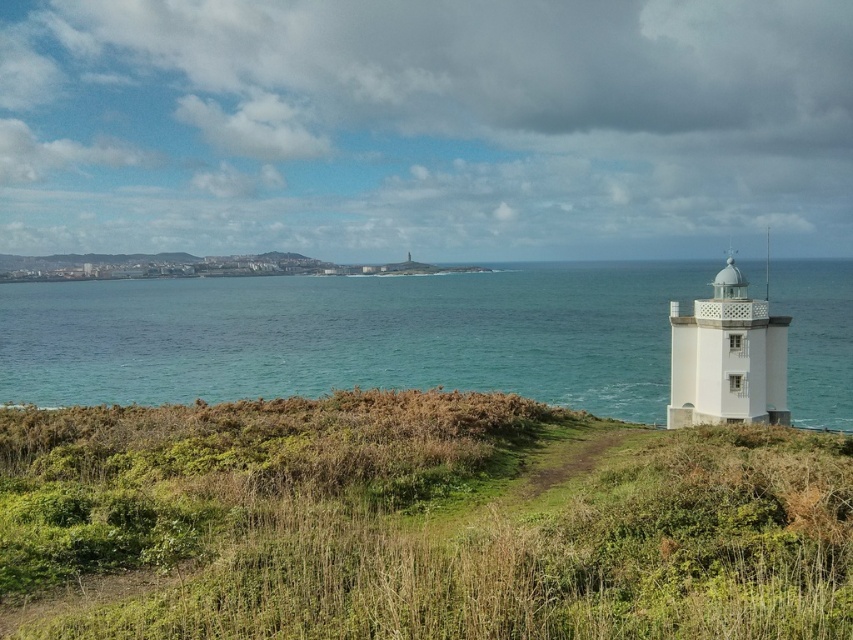
You are a hiker who wants to reach the blue water at center from the green grassy at right. Based on the scene, which direction should you move towards?

Since the green grassy at right is in front of the blue water at center, you should move towards the direction away from the blue water at center to reach it.

You are a tourist standing at the base of the white matte lighthouse at right. You want to take a photo of the blue water at center. In which direction should you point your camera?

The blue water at center is to the left of the white matte lighthouse at right, so you should point your camera to the left to capture the blue water at center.

You are a drone operator trying to capture a photo of the white lighthouse. Your drone is currently hovering at point (416, 522). What is the terrain directly below your drone?

The terrain directly below the drone at point (416, 522) is green grassy at right.